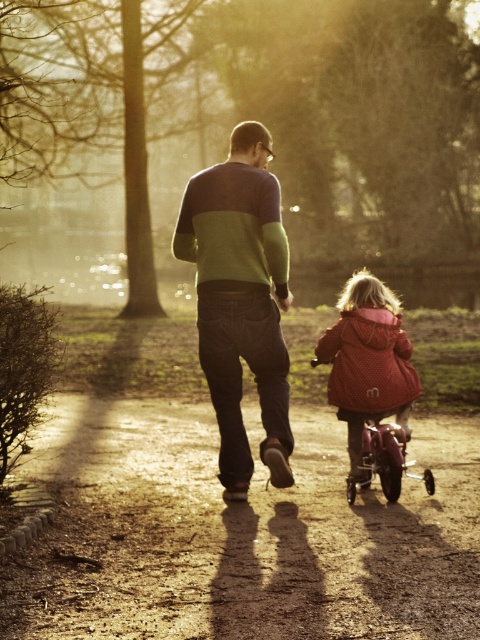
Question: Which object is the closest to the dirt path at center?

Choices:
 (A) green sweater at center
 (B) metallic pink baby carriage at lower right

Answer: (B)

Question: Which is farther from the dirt path at center?

Choices:
 (A) metallic pink baby carriage at lower right
 (B) green sweater at center
 (C) matte pink coat at center

Answer: (C)

Question: Which of these objects is positioned farthest from the metallic pink baby carriage at lower right?

Choices:
 (A) matte pink coat at center
 (B) green sweater at center
 (C) dirt path at center

Answer: (C)

Question: Is dirt path at center behind matte pink coat at center?

Choices:
 (A) no
 (B) yes

Answer: (A)

Question: Where is green sweater at center located in relation to matte pink coat at center in the image?

Choices:
 (A) right
 (B) left

Answer: (B)

Question: Is dirt path at center thinner than metallic pink baby carriage at lower right?

Choices:
 (A) no
 (B) yes

Answer: (A)